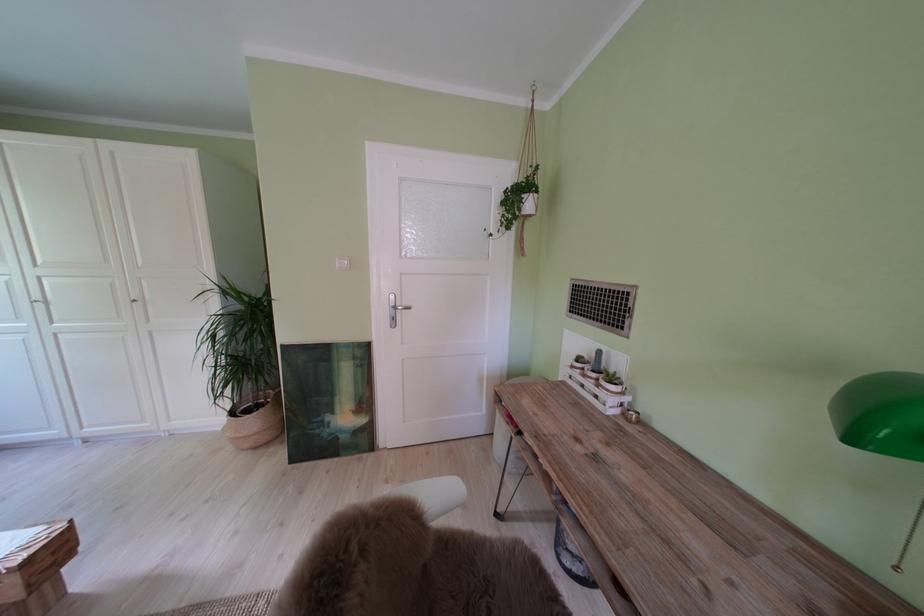
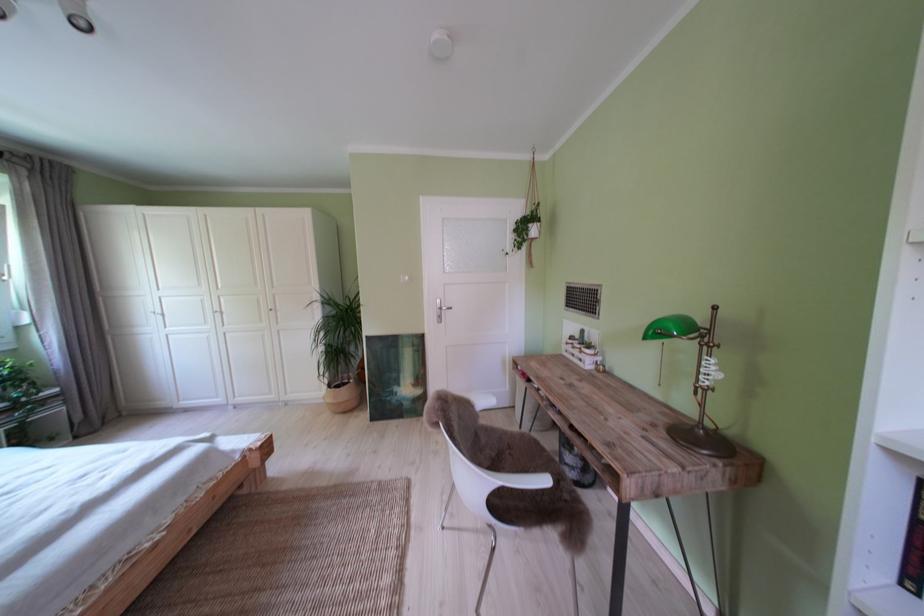
The point at (242, 418) is marked in the first image. Where is the corresponding point in the second image?

(341, 392)